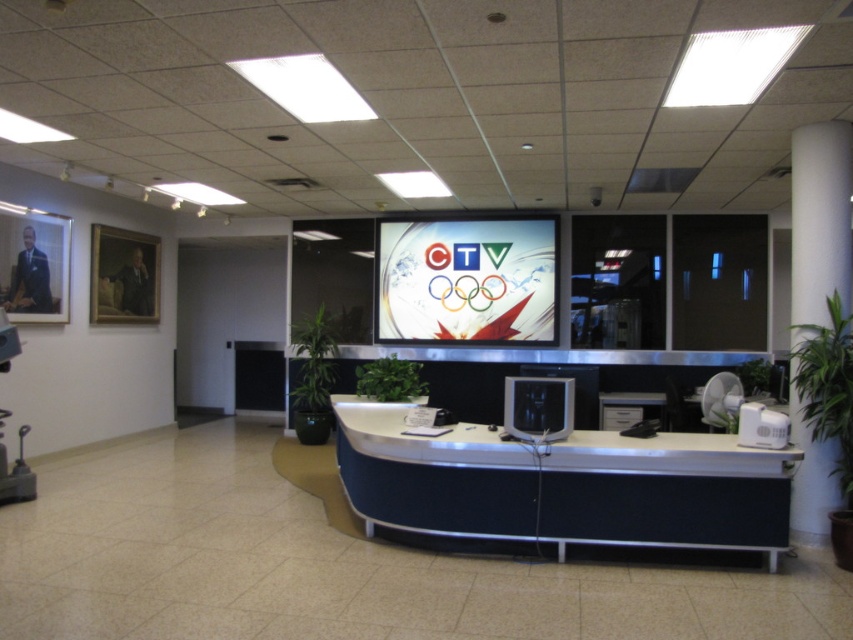
Does white smooth pillar at right appear under metallic silver swivel chair at left?

No.

Does white smooth pillar at right appear on the right side of metallic silver swivel chair at left?

Indeed, white smooth pillar at right is positioned on the right side of metallic silver swivel chair at left.

Is point (838, 218) more distant than point (7, 369)?

That is False.

At what (x,y) coordinates should I click in order to perform the action: click on white smooth pillar at right. Please return your answer as a coordinate pair (x, y). This screenshot has height=640, width=853. Looking at the image, I should click on (820, 218).

Is satin black monitor at center taller than metallic silver swivel chair at left?

In fact, satin black monitor at center may be shorter than metallic silver swivel chair at left.

Who is higher up, satin black monitor at center or metallic silver swivel chair at left?

satin black monitor at center is above.

Who is more distant from viewer, (x=521, y=419) or (x=13, y=486)?

Point (x=13, y=486)

Locate an element on the screen. satin black monitor at center is located at coordinates click(x=538, y=406).

Between white smooth pillar at right and satin black monitor at center, which one is positioned higher?

white smooth pillar at right

Does white smooth pillar at right have a smaller size compared to satin black monitor at center?

Actually, white smooth pillar at right might be larger than satin black monitor at center.

This screenshot has height=640, width=853. I want to click on white smooth pillar at right, so (820, 218).